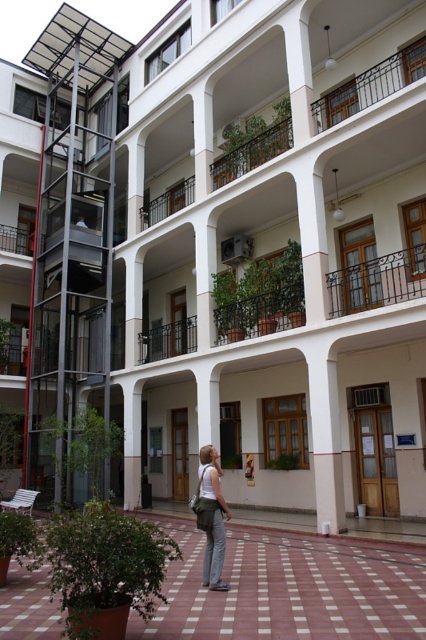
You are standing in the courtyard and want to place a small potted plant on the ground. The potted plant must be placed on the terracotta tiles at center so that it is visible from the balcony above. Since the matte white tank top at center is already occupying space there, will the potted plant be visible from above?

The terracotta tiles at center has a lesser height compared to the matte white tank top at center, so the potted plant placed on the terracotta tiles at center may be partially or fully obscured by the taller matte white tank top at center when viewed from above.

Looking at this image, you are standing in the courtyard and want to place a matte white tank top at center on top of the terracotta tiles at center. Will the tank top fit entirely on the tiles?

The terracotta tiles at center have a larger width than the matte white tank top at center, so the tank top will fit entirely on the tiles.